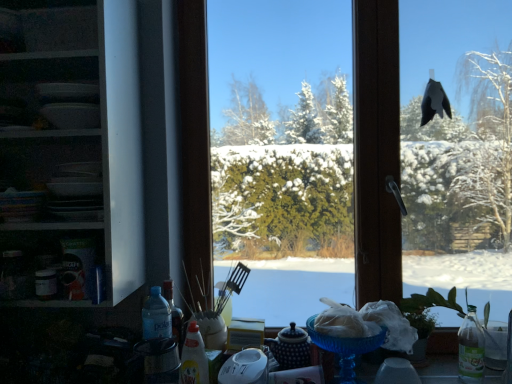
Question: From a real-world perspective, is transparent glass window at center on top of white glossy shelves at left?

Choices:
 (A) yes
 (B) no

Answer: (B)

Question: Could you tell me if transparent glass window at center is turned towards white glossy shelves at left?

Choices:
 (A) no
 (B) yes

Answer: (A)

Question: Can you confirm if transparent glass window at center is wider than white glossy shelves at left?

Choices:
 (A) no
 (B) yes

Answer: (A)

Question: From a real-world perspective, is transparent glass window at center positioned under white glossy shelves at left based on gravity?

Choices:
 (A) yes
 (B) no

Answer: (A)

Question: Is transparent glass window at center at the left side of white glossy shelves at left?

Choices:
 (A) yes
 (B) no

Answer: (B)

Question: Looking at their shapes, would you say blue glass bowl at lower center is wider or thinner than translucent plastic bottle at center?

Choices:
 (A) wide
 (B) thin

Answer: (A)

Question: From their relative heights in the image, would you say blue glass bowl at lower center is taller or shorter than translucent plastic bottle at center?

Choices:
 (A) tall
 (B) short

Answer: (B)

Question: Does point (336, 349) appear closer or farther from the camera than point (199, 357)?

Choices:
 (A) closer
 (B) farther

Answer: (B)

Question: In the image, is blue glass bowl at lower center on the left side or the right side of translucent plastic bottle at center?

Choices:
 (A) right
 (B) left

Answer: (A)

Question: Considering the positions of white glossy shelves at left and translucent plastic bottle at center in the image, is white glossy shelves at left wider or thinner than translucent plastic bottle at center?

Choices:
 (A) thin
 (B) wide

Answer: (B)

Question: Choose the correct answer: Is white glossy shelves at left inside translucent plastic bottle at center or outside it?

Choices:
 (A) outside
 (B) inside

Answer: (A)

Question: Is white glossy shelves at left in front of or behind translucent plastic bottle at center in the image?

Choices:
 (A) behind
 (B) front

Answer: (B)

Question: Is white glossy shelves at left to the left or to the right of translucent plastic bottle at center in the image?

Choices:
 (A) right
 (B) left

Answer: (B)

Question: Considering their positions, is blue glass bowl at lower center located in front of or behind white glossy shelves at left?

Choices:
 (A) behind
 (B) front

Answer: (A)

Question: From a real-world perspective, is blue glass bowl at lower center above or below white glossy shelves at left?

Choices:
 (A) above
 (B) below

Answer: (B)